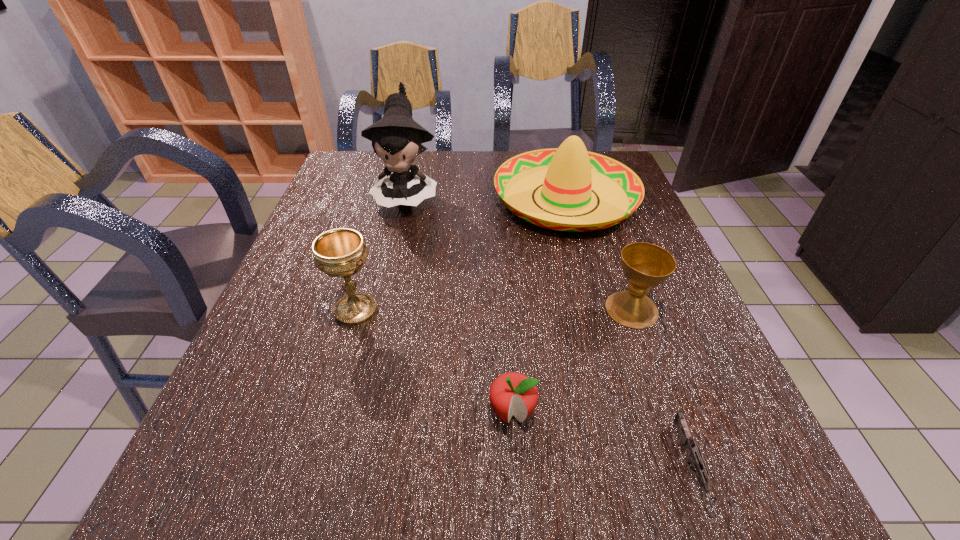
At what (x,y) coordinates should I click in order to perform the action: click on blank area located on the left of the shorter chalice. Please return your answer as a coordinate pair (x, y). This screenshot has height=540, width=960. Looking at the image, I should click on (439, 309).

Identify the location of vacant area situated 0.390m on the left of the apple. (258, 412).

You are a GUI agent. You are given a task and a screenshot of the screen. Output one action in this format:
    pyautogui.click(x=<x>, y=<y>)
    Task: Click on the doll at the far edge
    
    Given the screenshot: What is the action you would take?
    pyautogui.click(x=396, y=138)

I want to click on sombrero located at the far edge, so click(x=569, y=173).

Image resolution: width=960 pixels, height=540 pixels. In order to click on object that is at the near edge in this screenshot , I will do `click(695, 457)`.

Where is `doll located in the left edge section of the desktop`? doll located in the left edge section of the desktop is located at coordinates (396, 138).

Find the location of `chalice that is at the left edge`. chalice that is at the left edge is located at coordinates (341, 252).

What are the coordinates of `sombrero positioned at the right edge` in the screenshot? It's located at (569, 173).

Locate an element on the screen. chalice situated at the right edge is located at coordinates (645, 265).

Identify the location of gun that is at the right edge. The width and height of the screenshot is (960, 540). (695, 457).